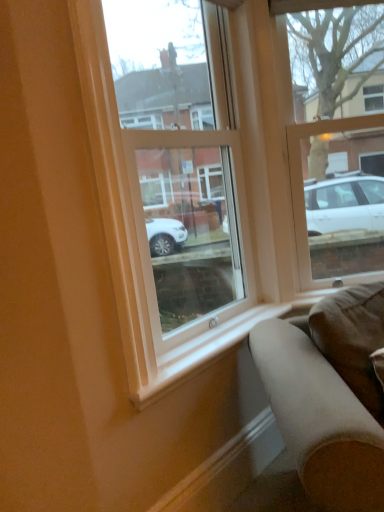
Measure the distance between point [344,218] and camera.

Point [344,218] and camera are 9.27 feet apart from each other.

What do you see at coordinates (220, 182) in the screenshot? I see `transparent glass window at center, which appears as the 1th window when viewed from the left` at bounding box center [220, 182].

Where is `transparent glass window at center, placed as the 2th window when sorted from right to left`? transparent glass window at center, placed as the 2th window when sorted from right to left is located at coordinates (220, 182).

Measure the distance between point (321,325) and camera.

A distance of 5.29 feet exists between point (321,325) and camera.

Locate an element on the screen. This screenshot has height=512, width=384. suede-like brown couch at lower right is located at coordinates (324, 401).

The height and width of the screenshot is (512, 384). I want to click on clear glass window at upper right, the first window viewed from the right, so pyautogui.click(x=336, y=143).

Is suede-like brown couch at lower right not near smooth wood curb at lower center?

No, suede-like brown couch at lower right is in close proximity to smooth wood curb at lower center.

Is suede-like brown couch at lower right looking in the opposite direction of smooth wood curb at lower center?

No, suede-like brown couch at lower right's orientation is not away from smooth wood curb at lower center.

Who is shorter, transparent glass window at center, placed as the 2th window when sorted from right to left, or clear glass window at upper right, the first window viewed from the right?

clear glass window at upper right, the first window viewed from the right.

Is the surface of transparent glass window at center, which appears as the 1th window when viewed from the left, in direct contact with clear glass window at upper right, the first window viewed from the right?

transparent glass window at center, which appears as the 1th window when viewed from the left, is not next to clear glass window at upper right, the first window viewed from the right, and they're not touching.

Choose the correct answer: Is transparent glass window at center, placed as the 2th window when sorted from right to left, inside clear glass window at upper right, the first window viewed from the right, or outside it?

The correct answer is: outside.

Which of these two, transparent glass window at center, placed as the 2th window when sorted from right to left, or clear glass window at upper right, the 2th window in the left-to-right sequence, is bigger?

transparent glass window at center, placed as the 2th window when sorted from right to left.

Is white smooth window sill at lower center inside or outside of clear glass window at upper right, the first window viewed from the right?

white smooth window sill at lower center is not enclosed by clear glass window at upper right, the first window viewed from the right.

Consider the image. Considering the sizes of objects white smooth window sill at lower center and clear glass window at upper right, the first window viewed from the right, in the image provided, who is shorter, white smooth window sill at lower center or clear glass window at upper right, the first window viewed from the right,?

Standing shorter between the two is white smooth window sill at lower center.

Relative to clear glass window at upper right, the 2th window in the left-to-right sequence, is brown suede pillow at lower right in front or behind?

brown suede pillow at lower right is positioned closer to the viewer than clear glass window at upper right, the 2th window in the left-to-right sequence.

Between brown suede pillow at lower right and clear glass window at upper right, the first window viewed from the right, which one has less height?

With less height is brown suede pillow at lower right.

Where is `pillow on the left of clear glass window at upper right, the 2th window in the left-to-right sequence`? Image resolution: width=384 pixels, height=512 pixels. pillow on the left of clear glass window at upper right, the 2th window in the left-to-right sequence is located at coordinates (353, 339).

Who is bigger, brown suede pillow at lower right or clear glass window at upper right, the 2th window in the left-to-right sequence?

clear glass window at upper right, the 2th window in the left-to-right sequence.

Is smooth wood curb at lower center oriented away from suede-like brown couch at lower right?

smooth wood curb at lower center does not have its back to suede-like brown couch at lower right.

Can you tell me how much smooth wood curb at lower center and suede-like brown couch at lower right differ in facing direction?

There is a 44.6-degree angle between the facing directions of smooth wood curb at lower center and suede-like brown couch at lower right.

Is smooth wood curb at lower center situated inside suede-like brown couch at lower right or outside?

The correct answer is: outside.

From a real-world perspective, which is physically above, brown suede pillow at lower right or transparent glass window at center, which appears as the 1th window when viewed from the left?

transparent glass window at center, which appears as the 1th window when viewed from the left, is physically above.

Does brown suede pillow at lower right touch transparent glass window at center, which appears as the 1th window when viewed from the left?

No, brown suede pillow at lower right is not touching transparent glass window at center, which appears as the 1th window when viewed from the left.

Where is `pillow behind the transparent glass window at center, placed as the 2th window when sorted from right to left`? pillow behind the transparent glass window at center, placed as the 2th window when sorted from right to left is located at coordinates (353, 339).

Consider the image. Which is farther, [323,312] or [191,124]?

The point [191,124] is farther from the camera.

Consider the image. Considering the sizes of objects smooth wood curb at lower center and brown suede pillow at lower right in the image provided, who is bigger, smooth wood curb at lower center or brown suede pillow at lower right?

Bigger between the two is brown suede pillow at lower right.

Choose the correct answer: Is smooth wood curb at lower center inside brown suede pillow at lower right or outside it?

smooth wood curb at lower center cannot be found inside brown suede pillow at lower right.

From a real-world perspective, is smooth wood curb at lower center physically above brown suede pillow at lower right?

No.

Are smooth wood curb at lower center and brown suede pillow at lower right far apart?

Actually, smooth wood curb at lower center and brown suede pillow at lower right are a little close together.

The image size is (384, 512). In order to click on studio couch located above the smooth wood curb at lower center (from a real-world perspective) in this screenshot , I will do `click(324, 401)`.

What are the coordinates of `window above the transparent glass window at center, placed as the 2th window when sorted from right to left (from the image's perspective)` in the screenshot? It's located at (336, 143).

Based on their spatial positions, is transparent glass window at center, placed as the 2th window when sorted from right to left, or suede-like brown couch at lower right further from brown suede pillow at lower right?

Based on the image, transparent glass window at center, placed as the 2th window when sorted from right to left, appears to be further to brown suede pillow at lower right.

Estimate the real-world distances between objects in this image. Which object is further from brown suede pillow at lower right, suede-like brown couch at lower right or smooth wood curb at lower center?

smooth wood curb at lower center.

From the image, which object appears to be nearer to suede-like brown couch at lower right, clear glass window at upper right, the 2th window in the left-to-right sequence, or white smooth window sill at lower center?

white smooth window sill at lower center is closer to suede-like brown couch at lower right.

Looking at the image, which one is located closer to white smooth window sill at lower center, smooth wood curb at lower center or brown suede pillow at lower right?

smooth wood curb at lower center is positioned closer to the anchor white smooth window sill at lower center.

When comparing their distances from white smooth window sill at lower center, does transparent glass window at center, which appears as the 1th window when viewed from the left, or smooth wood curb at lower center seem closer?

smooth wood curb at lower center is positioned closer to the anchor white smooth window sill at lower center.

When comparing their distances from smooth wood curb at lower center, does white smooth window sill at lower center or suede-like brown couch at lower right seem further?

Based on the image, suede-like brown couch at lower right appears to be further to smooth wood curb at lower center.

In the scene shown: Estimate the real-world distances between objects in this image. Which object is further from smooth wood curb at lower center, clear glass window at upper right, the first window viewed from the right, or white smooth window sill at lower center?

clear glass window at upper right, the first window viewed from the right, lies further to smooth wood curb at lower center than the other object.

Estimate the real-world distances between objects in this image. Which object is closer to clear glass window at upper right, the first window viewed from the right, suede-like brown couch at lower right or brown suede pillow at lower right?

brown suede pillow at lower right is closer to clear glass window at upper right, the first window viewed from the right.

Locate an element on the screen. This screenshot has width=384, height=512. studio couch between white smooth window sill at lower center and brown suede pillow at lower right from left to right is located at coordinates (324, 401).

Find the location of a particular element. window sill located between suede-like brown couch at lower right and smooth wood curb at lower center in the depth direction is located at coordinates (192, 354).

In order to click on window between clear glass window at upper right, the first window viewed from the right, and brown suede pillow at lower right, in the vertical direction in this screenshot , I will do `click(220, 182)`.

Identify the location of studio couch between clear glass window at upper right, the 2th window in the left-to-right sequence, and smooth wood curb at lower center in the up-down direction. This screenshot has width=384, height=512. (324, 401).